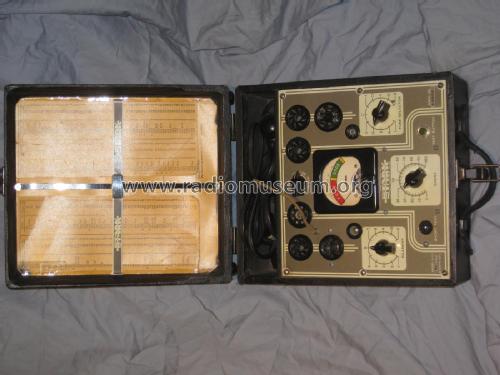
Find the location of `handle`. handle is located at coordinates (491, 191).